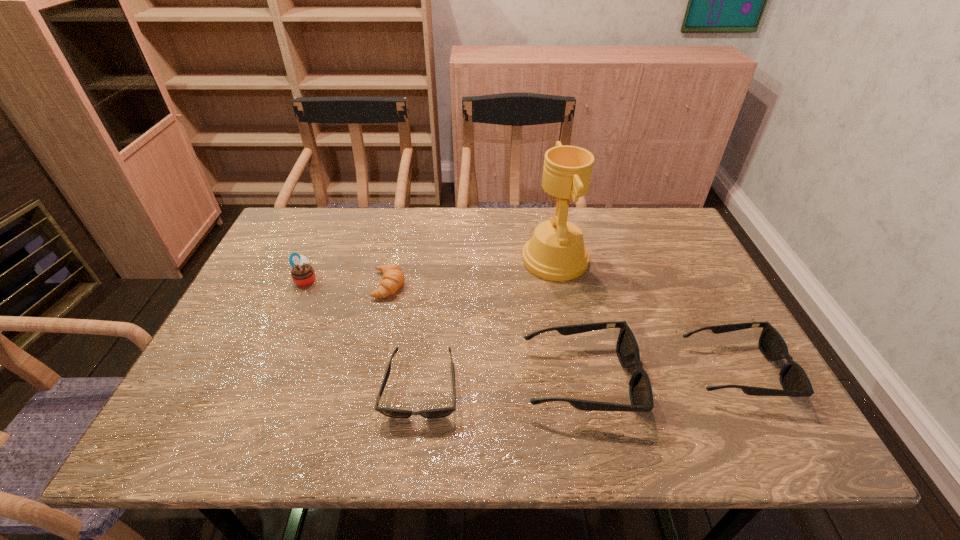
In the image, there is a desktop. Identify the location of vacant space at the far left corner. (317, 218).

In the image, there is a desktop. At what (x,y) coordinates should I click in order to perform the action: click on vacant region at the far right corner. Please return your answer as a coordinate pair (x, y). This screenshot has height=540, width=960. Looking at the image, I should click on (641, 249).

At what (x,y) coordinates should I click in order to perform the action: click on vacant point at the near right corner. Please return your answer as a coordinate pair (x, y). The image size is (960, 540). Looking at the image, I should click on (751, 385).

Locate an element on the screen. empty space between the second tallest object and the crescent roll is located at coordinates (348, 282).

Find the location of a particular element. Image resolution: width=960 pixels, height=540 pixels. free point between the rightmost sunglasses and the second sunglasses from left to right is located at coordinates (659, 375).

Image resolution: width=960 pixels, height=540 pixels. Find the location of `vacant area that lies between the shortest sunglasses and the second shortest sunglasses`. vacant area that lies between the shortest sunglasses and the second shortest sunglasses is located at coordinates (579, 380).

Identify the location of empty location between the leftmost object and the tallest object. (430, 269).

The width and height of the screenshot is (960, 540). Identify the location of vacant space that's between the leftmost object and the shortest sunglasses. coord(364,334).

I want to click on vacant area that lies between the second sunglasses from left to right and the leftmost sunglasses, so pyautogui.click(x=501, y=384).

Where is `free area in between the leftmost object and the shortest sunglasses`? The height and width of the screenshot is (540, 960). free area in between the leftmost object and the shortest sunglasses is located at coordinates (364, 334).